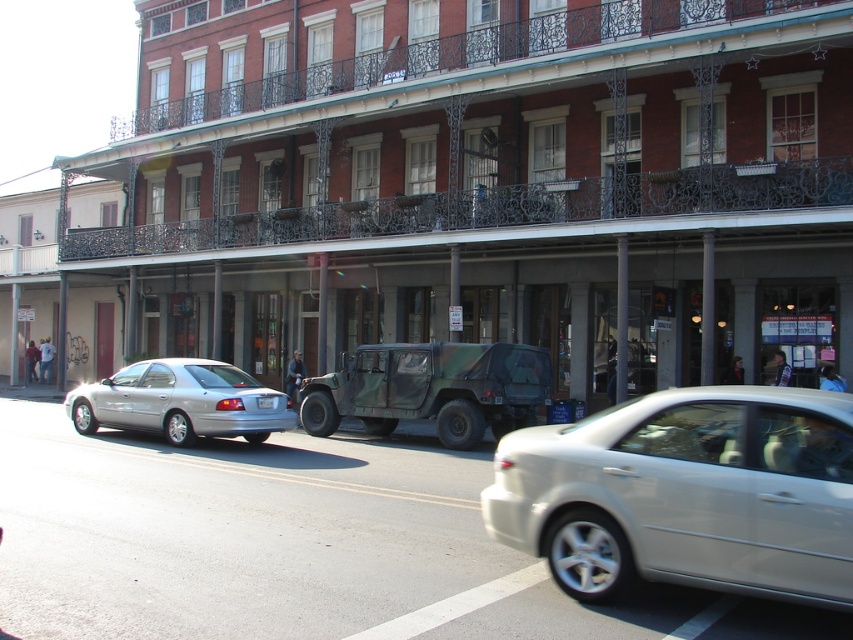
Is camouflage fabric jeep at center wider than silver metallic sedan at left?

No.

Is camouflage fabric jeep at center in front of silver metallic sedan at left?

No.

Who is more forward, (469, 436) or (135, 381)?

Point (135, 381) is more forward.

I want to click on camouflage fabric jeep at center, so click(x=431, y=388).

The image size is (853, 640). I want to click on silver metallic sedan at center, so click(686, 493).

Locate an element on the screen. This screenshot has width=853, height=640. silver metallic sedan at center is located at coordinates (686, 493).

Between silver metallic sedan at center and camouflage fabric jeep at center, which one has less height?

silver metallic sedan at center is shorter.

This screenshot has width=853, height=640. I want to click on silver metallic sedan at center, so click(x=686, y=493).